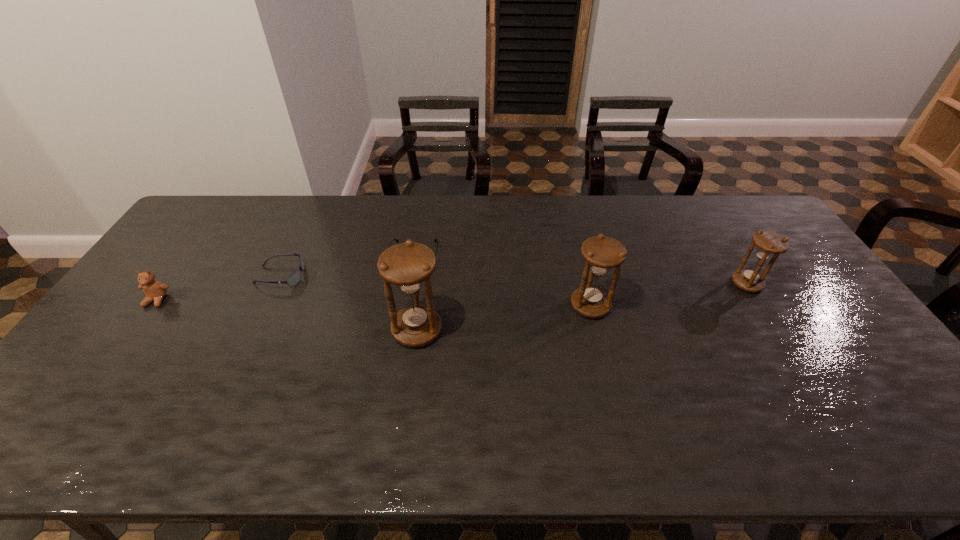
The image size is (960, 540). In order to click on free point that keeps the hourglasss evenly spaced on the left in this screenshot , I will do `click(225, 357)`.